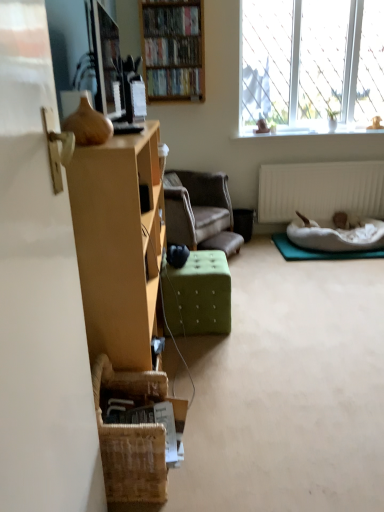
Question: Is wooden bookshelf at upper center, the first book viewed from the top, bigger or smaller than white soft pet bed at lower right?

Choices:
 (A) small
 (B) big

Answer: (A)

Question: Is point (168, 19) closer or farther from the camera than point (309, 247)?

Choices:
 (A) farther
 (B) closer

Answer: (B)

Question: Which is nearer to the hardcover books at upper center, marked as the third book in a top-to-bottom arrangement?

Choices:
 (A) white textured radiator at lower right
 (B) velvet brown armchair at center
 (C) brown woven basket at lower left
 (D) white soft pet bed at lower right
 (E) wooden bookshelf at upper center, the first book viewed from the top

Answer: (E)

Question: Estimate the real-world distances between objects in this image. Which object is farther from the shiny plastic bookshelf at upper center, the second book viewed from the top?

Choices:
 (A) green fabric ottoman at center
 (B) wooden bookshelf at upper center, the first book viewed from the top
 (C) hardcover books at upper center, marked as the third book in a top-to-bottom arrangement
 (D) wooden bookshelf at upper center
 (E) brown woven basket at lower left

Answer: (E)